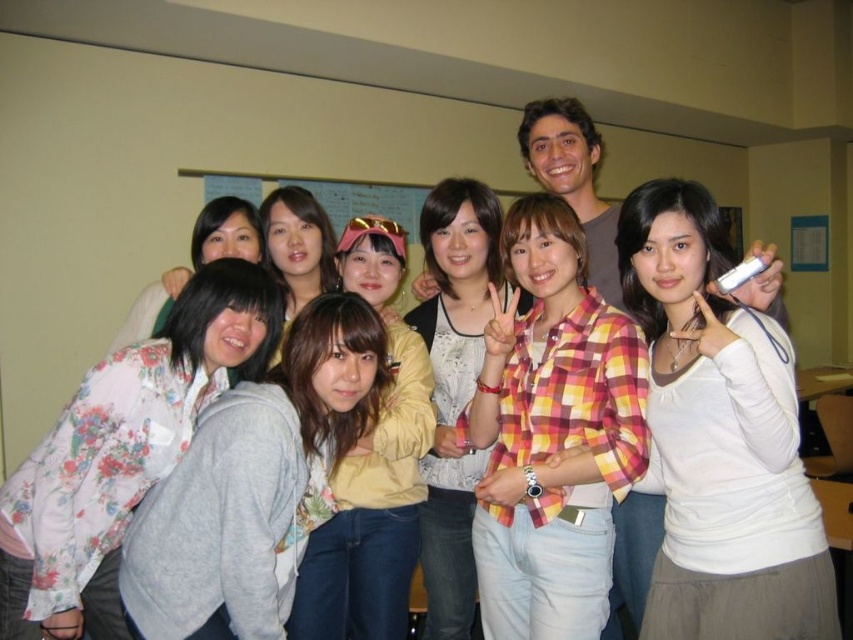
Question: From the image, what is the correct spatial relationship of floral fabric blouse at left in relation to yellow plaid shirt at center?

Choices:
 (A) left
 (B) right

Answer: (A)

Question: Is white matte shirt at center above yellow fabric shirt at center?

Choices:
 (A) no
 (B) yes

Answer: (A)

Question: Estimate the real-world distances between objects in this image. Which object is farther from the yellow fabric shirt at center?

Choices:
 (A) floral fabric blouse at left
 (B) gray fleece jacket at center
 (C) white matte shirt at center

Answer: (C)

Question: Which object is positioned closest to the gray fleece jacket at center?

Choices:
 (A) yellow plaid shirt at center
 (B) white matte shirt at center
 (C) floral fabric blouse at left
 (D) yellow fabric shirt at center

Answer: (C)

Question: Which point is closer to the camera?

Choices:
 (A) (193, 445)
 (B) (285, 211)
 (C) (227, 272)
 (D) (471, 317)

Answer: (A)

Question: Can you confirm if white matte shirt at center is positioned below floral fabric blouse at left?

Choices:
 (A) yes
 (B) no

Answer: (B)